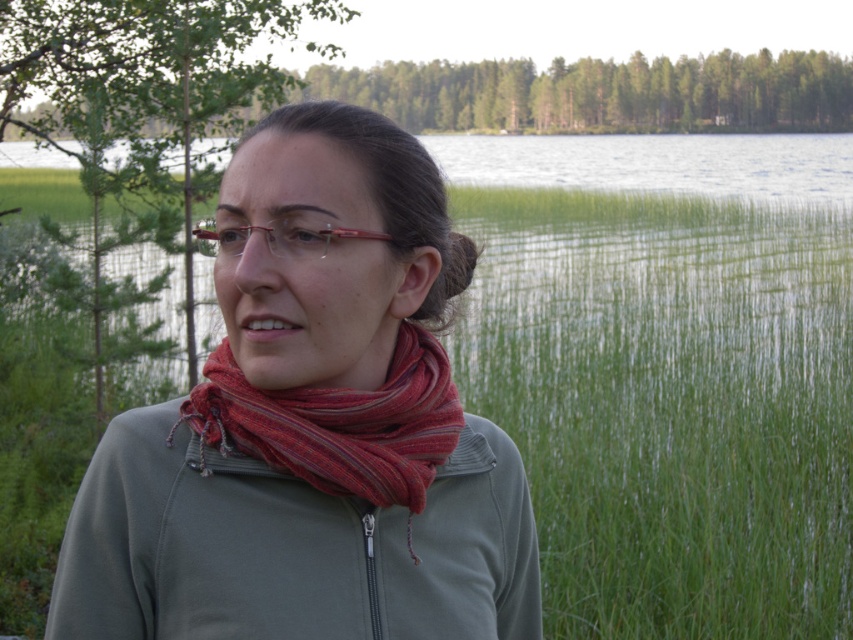
In the scene shown: Is striped wool scarf at center shorter than matte red glasses at center?

Indeed, striped wool scarf at center has a lesser height compared to matte red glasses at center.

Can you confirm if striped wool scarf at center is thinner than matte red glasses at center?

Yes.

This screenshot has height=640, width=853. In order to click on striped wool scarf at center in this screenshot , I will do `click(338, 426)`.

What are the coordinates of `striped wool scarf at center` in the screenshot? It's located at (338, 426).

Looking at this image, is green leafy tree at center below matte red glasses at center?

Incorrect, green leafy tree at center is not positioned below matte red glasses at center.

Which is below, green leafy tree at center or matte red glasses at center?

matte red glasses at center

Measure the distance between point (196, 172) and camera.

Point (196, 172) is 6.40 meters from camera.

The height and width of the screenshot is (640, 853). Find the location of `green leafy tree at center`. green leafy tree at center is located at coordinates (141, 92).

Which is behind, point (134, 454) or point (216, 252)?

Point (216, 252)

Find the location of a particular element. This screenshot has width=853, height=640. green fleece sweatshirt at center is located at coordinates (289, 547).

Between point (97, 481) and point (231, 228), which one is positioned behind?

The point (97, 481) is behind.

Identify the location of green fleece sweatshirt at center. This screenshot has width=853, height=640. coord(289,547).